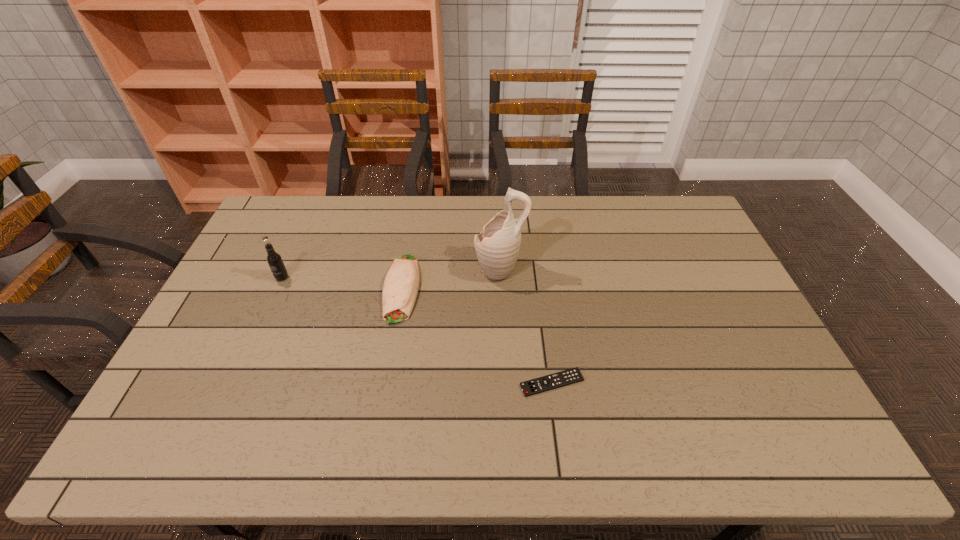
Where is `free location located on the label of the third shortest object`? This screenshot has width=960, height=540. free location located on the label of the third shortest object is located at coordinates (256, 335).

Find the location of a particular element. The width and height of the screenshot is (960, 540). free space located at the bitten end of the second object from left to right is located at coordinates (383, 397).

Where is `free spot located 0.350m on the back of the shortest object`? The image size is (960, 540). free spot located 0.350m on the back of the shortest object is located at coordinates (538, 276).

The width and height of the screenshot is (960, 540). I want to click on object that is positioned at the left edge, so click(x=275, y=262).

You are a GUI agent. You are given a task and a screenshot of the screen. Output one action in this format:
    pyautogui.click(x=<x>, y=<y>)
    Task: Click on the vacant space at the far edge of the desktop
    Image resolution: width=960 pixels, height=540 pixels.
    Given the screenshot: What is the action you would take?
    pyautogui.click(x=344, y=198)

Find the location of a particular element. vacant space at the near edge is located at coordinates (227, 447).

You are a GUI agent. You are given a task and a screenshot of the screen. Output one action in this format:
    pyautogui.click(x=<x>, y=<y>)
    Task: Click on the vacant space at the right edge of the desktop
    
    Given the screenshot: What is the action you would take?
    pyautogui.click(x=721, y=334)

Where is `free area in between the pitcher and the shortest object`? The image size is (960, 540). free area in between the pitcher and the shortest object is located at coordinates (526, 326).

Where is `vacant space in between the tallest object and the second shortest object`? vacant space in between the tallest object and the second shortest object is located at coordinates (451, 279).

In order to click on unoccupied area between the shortest object and the third object from right to left in this screenshot , I will do `click(477, 335)`.